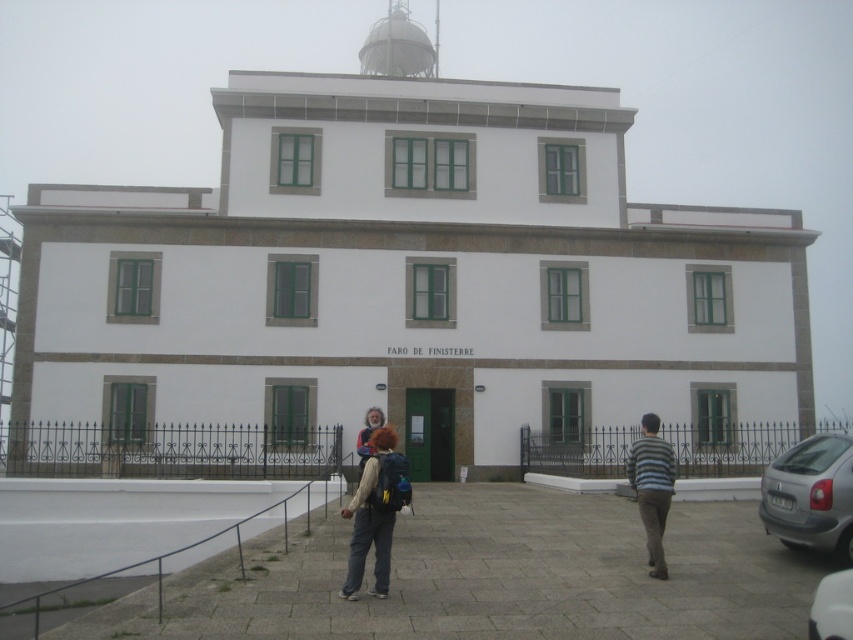
Describe the element at coordinates (653, 486) in the screenshot. The width and height of the screenshot is (853, 640). I see `striped cotton shirt at right` at that location.

Which is more to the left, striped cotton shirt at right or gray metallic car at lower right?

From the viewer's perspective, gray metallic car at lower right appears more on the left side.

Who is more distant from viewer, (651, 417) or (831, 577)?

Point (651, 417)

Locate an element on the screen. This screenshot has width=853, height=640. striped cotton shirt at right is located at coordinates (653, 486).

Is point (373, 438) positioned before point (822, 618)?

No.

Is matte white backpack at center wider than gray metallic car at lower right?

Correct, the width of matte white backpack at center exceeds that of gray metallic car at lower right.

Where is `matte white backpack at center`? The height and width of the screenshot is (640, 853). matte white backpack at center is located at coordinates (375, 513).

Find the location of a particular element. This screenshot has height=640, width=853. matte white backpack at center is located at coordinates (375, 513).

Is silver metallic car at lower right smaller than striped cotton shirt at right?

No, silver metallic car at lower right is not smaller than striped cotton shirt at right.

Is silver metallic car at lower right further to camera compared to striped cotton shirt at right?

Yes.

Who is more distant from viewer, [837,464] or [648,451]?

Point [837,464]

Locate an element on the screen. The width and height of the screenshot is (853, 640). silver metallic car at lower right is located at coordinates (811, 496).